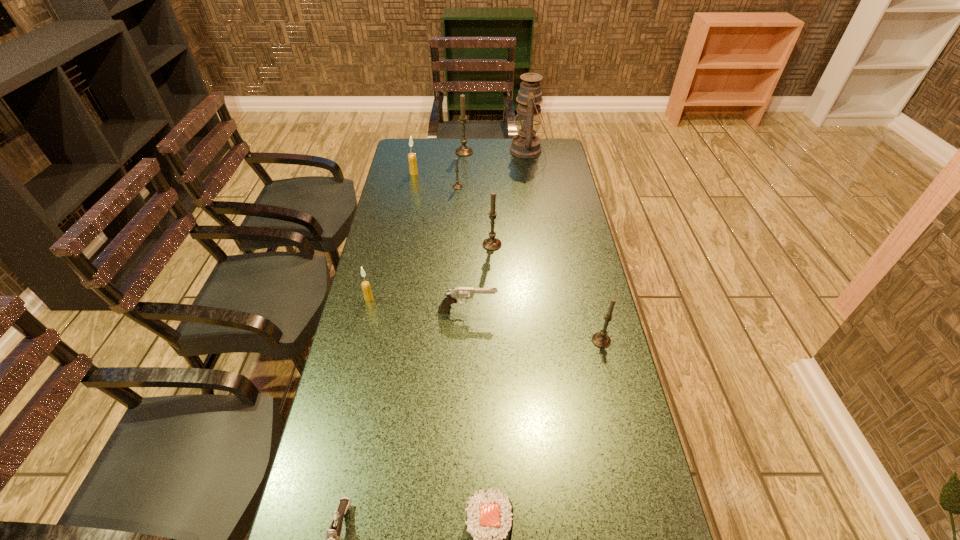
I want to click on free region located 0.380m on the back of the nearest candle, so click(x=579, y=247).

Identify the location of vacant point located 0.110m on the front of the third nearest gray candle. (456, 205).

You are a GUI agent. You are given a task and a screenshot of the screen. Output one action in this format:
    pyautogui.click(x=<x>, y=<y>)
    Task: Click on the vacant space positioned 0.280m on the front of the smaller cream candle
    This screenshot has height=540, width=960.
    Given the screenshot: What is the action you would take?
    tap(349, 380)

Find the location of a particular element. vacant space situated at the muzzle of the taller gun is located at coordinates (540, 310).

Where is `oil lamp at the far edge`? The width and height of the screenshot is (960, 540). oil lamp at the far edge is located at coordinates (525, 144).

The image size is (960, 540). I want to click on candle that is at the far edge, so click(x=463, y=150).

Find the location of `oil lamp that is at the right edge`. oil lamp that is at the right edge is located at coordinates (525, 144).

I want to click on candle positioned at the right edge, so click(x=600, y=339).

The height and width of the screenshot is (540, 960). What are the coordinates of `object that is at the far right corner` in the screenshot? It's located at (525, 144).

In the image, there is a desktop. At what (x,y) coordinates should I click in order to perform the action: click on vacant space at the far edge. Please return your answer as a coordinate pair (x, y). The height and width of the screenshot is (540, 960). Looking at the image, I should click on (510, 153).